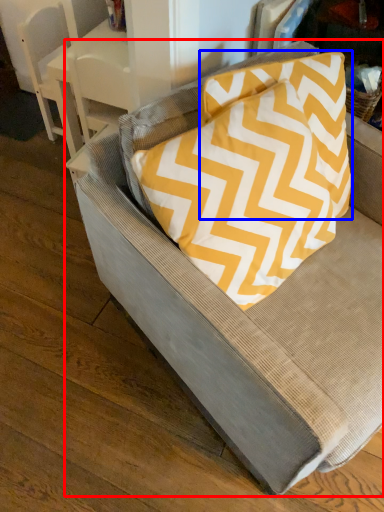
Question: Which object appears farthest to the camera in this image, chair (highlighted by a red box) or pillow (highlighted by a blue box)?

Choices:
 (A) chair
 (B) pillow

Answer: (B)